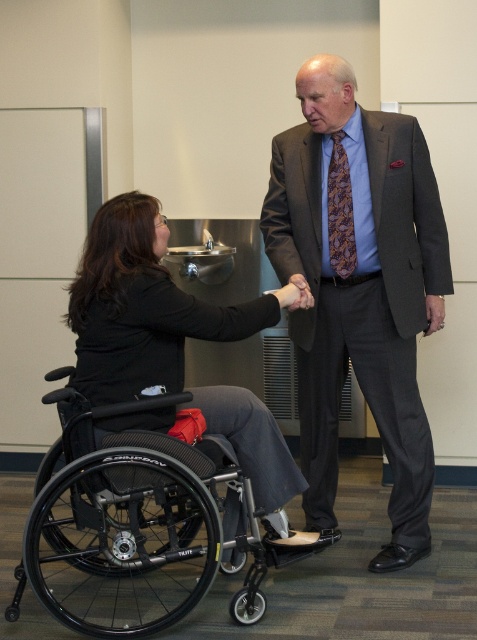
Question: Which of the following is the farthest from the observer?

Choices:
 (A) black fabric wheelchair at left
 (B) dark gray suit at center
 (C) black plastic wheelchair at lower left
 (D) purple patterned tie at center

Answer: (D)

Question: Does black fabric wheelchair at left have a greater width compared to purple patterned tie at center?

Choices:
 (A) yes
 (B) no

Answer: (A)

Question: Is black plastic wheelchair at lower left further to camera compared to matte black hand at center?

Choices:
 (A) no
 (B) yes

Answer: (A)

Question: Which point is farther to the camera?

Choices:
 (A) (73, 618)
 (B) (158, 364)
 (C) (346, 189)
 (D) (300, 276)

Answer: (C)

Question: Which object appears closest to the camera in this image?

Choices:
 (A) dark gray suit at center
 (B) matte black hand at center
 (C) black plastic wheelchair at lower left

Answer: (C)

Question: Does black fabric wheelchair at left come in front of matte black hand at center?

Choices:
 (A) no
 (B) yes

Answer: (B)